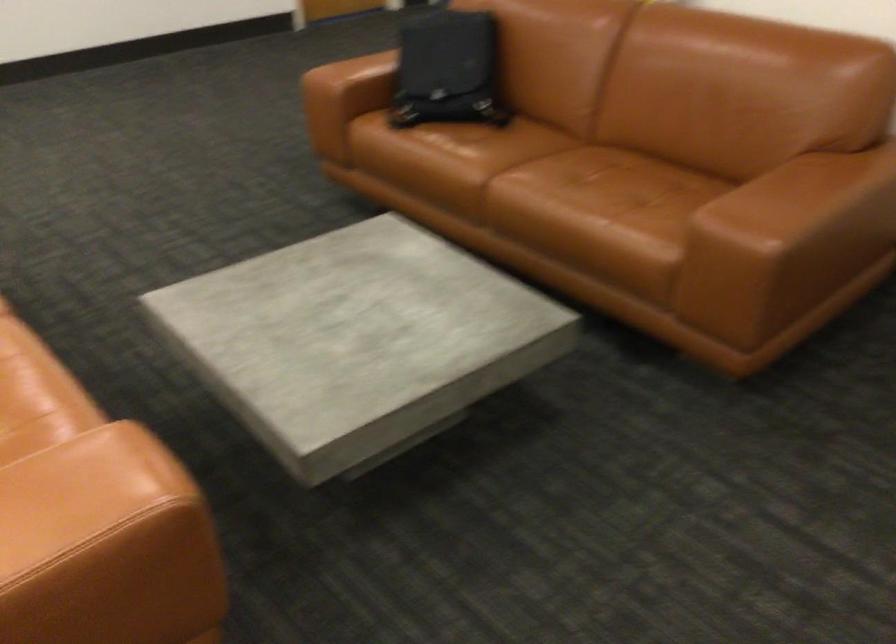
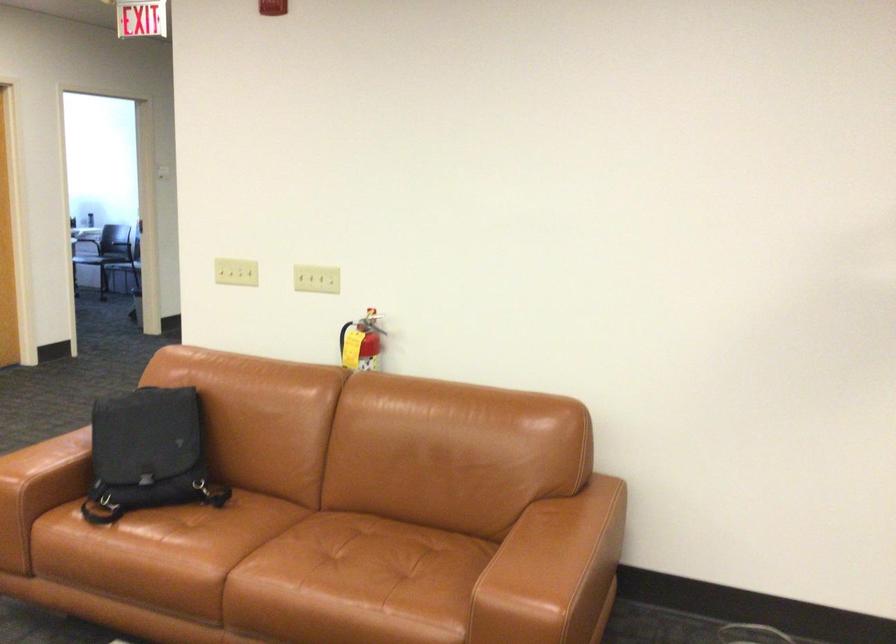
Locate, in the second image, the point that corresponds to the point at 368,70 in the first image.

(49, 467)